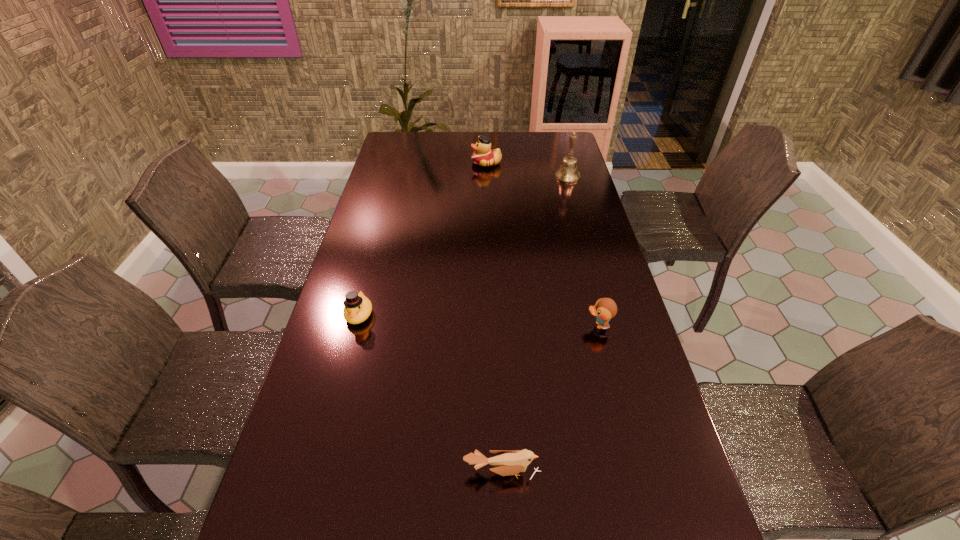
At what (x,y) coordinates should I click in order to perform the action: click on vacant area located 0.390m on the face of the farthest object. Please return your answer as a coordinate pair (x, y). Looking at the image, I should click on (383, 163).

Locate an element on the screen. This screenshot has width=960, height=540. blank space located 0.350m on the face of the farthest object is located at coordinates (392, 163).

I want to click on free region located on the front-facing side of the rightmost duck, so click(x=504, y=325).

You are a GUI agent. You are given a task and a screenshot of the screen. Output one action in this format:
    pyautogui.click(x=<x>, y=<y>)
    Task: Click on the vacant region located on the front-facing side of the rightmost duck
    This screenshot has height=540, width=960.
    Given the screenshot: What is the action you would take?
    pyautogui.click(x=480, y=325)

Locate an element on the screen. This screenshot has height=540, width=960. free spot located on the front-facing side of the rightmost duck is located at coordinates (476, 325).

The height and width of the screenshot is (540, 960). Find the location of `free location located 0.400m on the front-facing side of the leftmost object`. free location located 0.400m on the front-facing side of the leftmost object is located at coordinates (317, 472).

This screenshot has width=960, height=540. Identify the location of object positioned at the left edge. (x=358, y=307).

Image resolution: width=960 pixels, height=540 pixels. I want to click on bell located at the right edge, so click(568, 173).

Identify the location of duck that is at the right edge. The width and height of the screenshot is (960, 540). (605, 309).

Locate an element on the screen. Image resolution: width=960 pixels, height=540 pixels. free space at the left edge of the desktop is located at coordinates (390, 232).